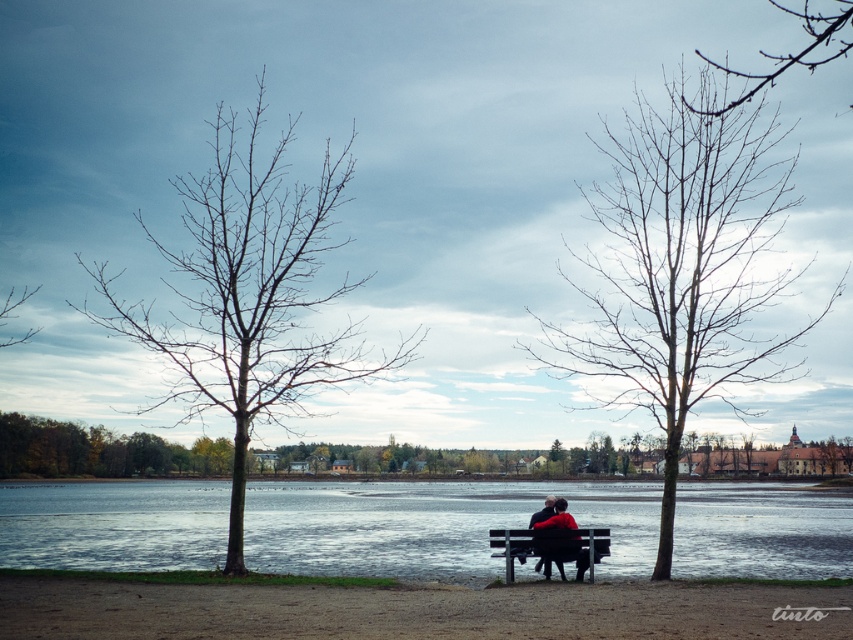
Question: Is smooth water at center closer to camera compared to bare branches at center?

Choices:
 (A) yes
 (B) no

Answer: (B)

Question: Which point is farther from the camera taking this photo?

Choices:
 (A) (527, 540)
 (B) (773, 70)
 (C) (558, 500)
 (D) (228, 300)

Answer: (B)

Question: Which object is positioned farthest from the black leather jacket at center?

Choices:
 (A) bare wood tree at center
 (B) bare branches at center
 (C) bare branches at upper right

Answer: (C)

Question: Considering the real-world distances, which object is farthest from the bare branches at center?

Choices:
 (A) black leather jacket at center
 (B) wooden bench at center
 (C) bare wood tree at center

Answer: (A)

Question: Is smooth water at center bigger than bare branches at upper right?

Choices:
 (A) yes
 (B) no

Answer: (A)

Question: Does wooden bench at center have a smaller size compared to black leather jacket at center?

Choices:
 (A) no
 (B) yes

Answer: (A)